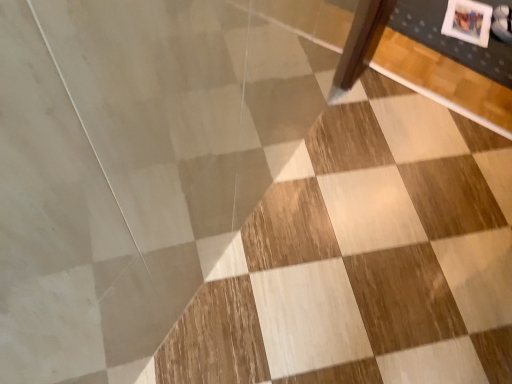
Question: Should I look upward or downward to see white matte photo frame at upper right?

Choices:
 (A) down
 (B) up

Answer: (B)